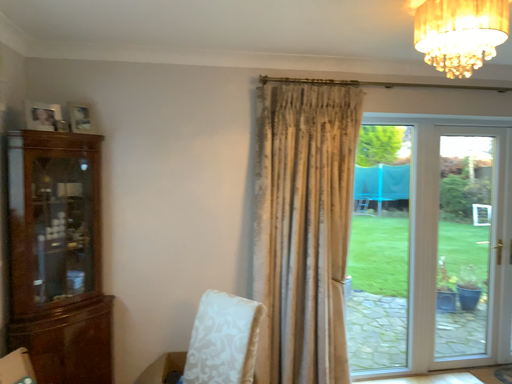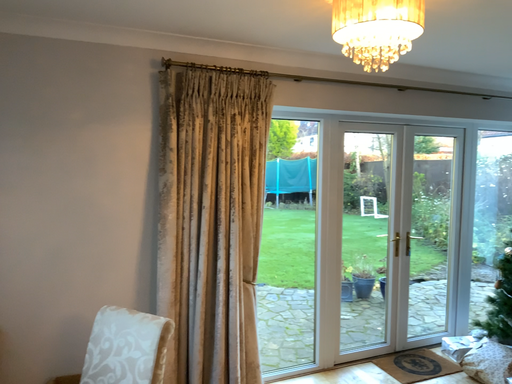
Question: How did the camera likely rotate when shooting the video?

Choices:
 (A) rotated left
 (B) rotated right

Answer: (B)